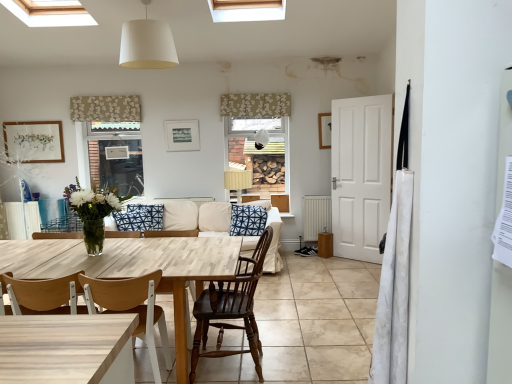
Question: Does white fabric lampshade at upper center, which is the third lamp in bottom-to-top order, have a lesser height compared to white matte picture frame at upper center, which is the second picture frame in left-to-right order?

Choices:
 (A) no
 (B) yes

Answer: (A)

Question: Does white fabric lampshade at upper center, marked as the third lamp in a right-to-left arrangement, appear on the right side of white matte picture frame at upper center, which is the second picture frame in left-to-right order?

Choices:
 (A) yes
 (B) no

Answer: (B)

Question: Are white fabric lampshade at upper center, which appears as the third lamp when viewed from the back, and white matte picture frame at upper center, which is the second picture frame in left-to-right order, located far from each other?

Choices:
 (A) yes
 (B) no

Answer: (A)

Question: From the image's perspective, is white fabric lampshade at upper center, which is the third lamp in bottom-to-top order, located above white matte picture frame at upper center, which is the 1th picture frame from right to left?

Choices:
 (A) no
 (B) yes

Answer: (B)

Question: From a real-world perspective, does white fabric lampshade at upper center, positioned as the first lamp in front-to-back order, stand above white matte picture frame at upper center, which is the second picture frame in left-to-right order?

Choices:
 (A) no
 (B) yes

Answer: (B)

Question: Considering the positions of beige floral fabric at upper left, the 3th curtain positioned from the right, and white fabric lampshade at upper center, which appears as the third lamp when viewed from the back, in the image, is beige floral fabric at upper left, the 3th curtain positioned from the right, taller or shorter than white fabric lampshade at upper center, which appears as the third lamp when viewed from the back,?

Choices:
 (A) short
 (B) tall

Answer: (A)

Question: Which is correct: beige floral fabric at upper left, the 2th curtain when ordered from bottom to top, is inside white fabric lampshade at upper center, positioned as the first lamp in front-to-back order, or outside of it?

Choices:
 (A) outside
 (B) inside

Answer: (A)

Question: Is beige floral fabric at upper left, which ranks as the 1th curtain in left-to-right order, to the left or to the right of white fabric lampshade at upper center, the 1th lamp positioned from the left, in the image?

Choices:
 (A) right
 (B) left

Answer: (B)

Question: In terms of width, does beige floral fabric at upper left, the 3th curtain positioned from the right, look wider or thinner when compared to white fabric lampshade at upper center, the 1th lamp positioned from the left?

Choices:
 (A) wide
 (B) thin

Answer: (B)

Question: In the image, is mahogany wood chair at center, which appears as the second chair when viewed from the left, on the left side or the right side of beige fabric couch at center?

Choices:
 (A) right
 (B) left

Answer: (A)

Question: Is mahogany wood chair at center, the first chair positioned from the right, wider or thinner than beige fabric couch at center?

Choices:
 (A) thin
 (B) wide

Answer: (A)

Question: From a real-world perspective, is mahogany wood chair at center, which appears as the second chair when viewed from the left, above or below beige fabric couch at center?

Choices:
 (A) above
 (B) below

Answer: (A)

Question: Considering the positions of mahogany wood chair at center, which appears as the second chair when viewed from the left, and beige fabric couch at center in the image, is mahogany wood chair at center, which appears as the second chair when viewed from the left, taller or shorter than beige fabric couch at center?

Choices:
 (A) tall
 (B) short

Answer: (A)

Question: Considering the positions of woven fabric lampshade at center, arranged as the 1th lamp when ordered from the bottom, and white fabric lampshade at upper center, positioned as the 1th lamp in back-to-front order, in the image, is woven fabric lampshade at center, arranged as the 1th lamp when ordered from the bottom, wider or thinner than white fabric lampshade at upper center, positioned as the 1th lamp in back-to-front order,?

Choices:
 (A) wide
 (B) thin

Answer: (A)

Question: Is woven fabric lampshade at center, marked as the 2th lamp in a right-to-left arrangement, spatially inside white fabric lampshade at upper center, which appears as the third lamp when viewed from the left, or outside of it?

Choices:
 (A) inside
 (B) outside

Answer: (B)